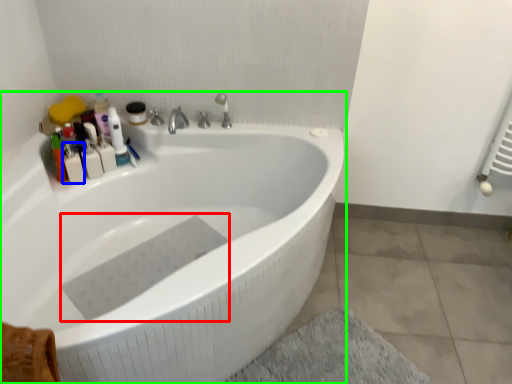
Question: Considering the real-world distances, which object is closest to bath towel (highlighted by a red box)? toiletry (highlighted by a blue box) or bathtub (highlighted by a green box).

Choices:
 (A) toiletry
 (B) bathtub

Answer: (B)